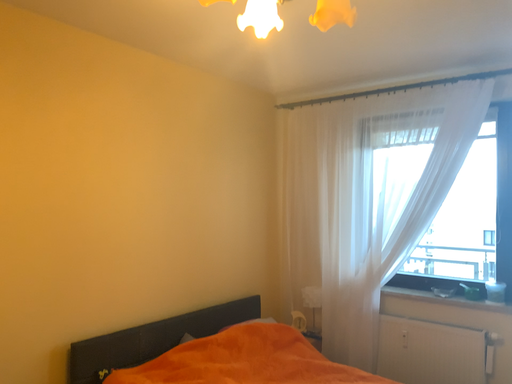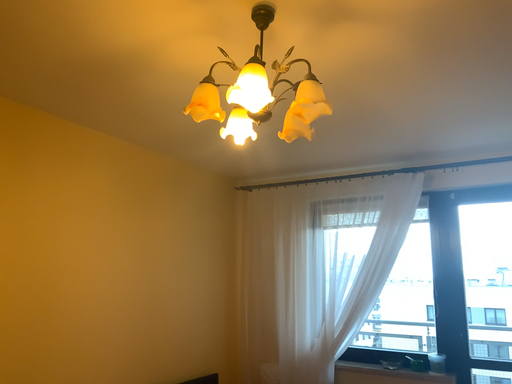
Question: Which way did the camera rotate in the video?

Choices:
 (A) rotated right
 (B) rotated left

Answer: (A)